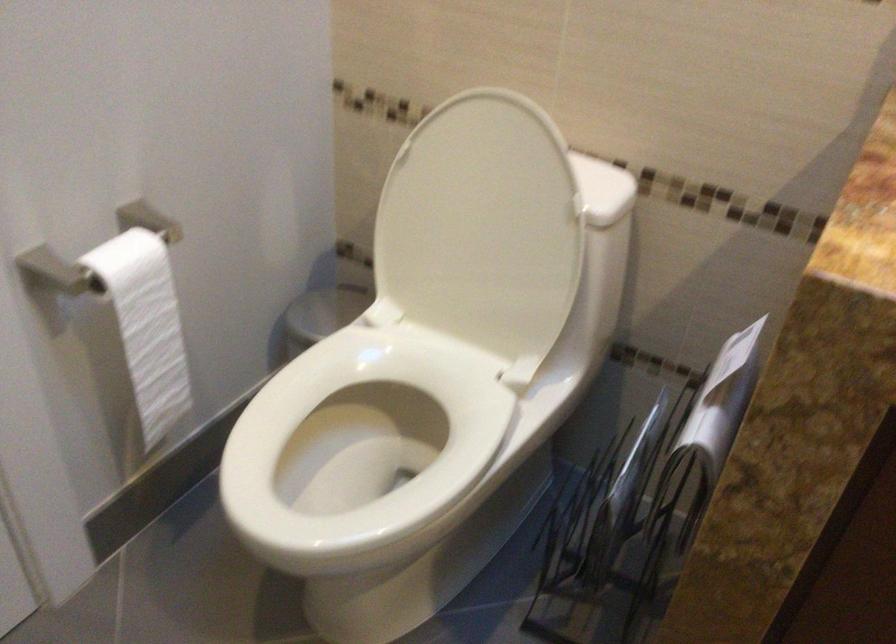
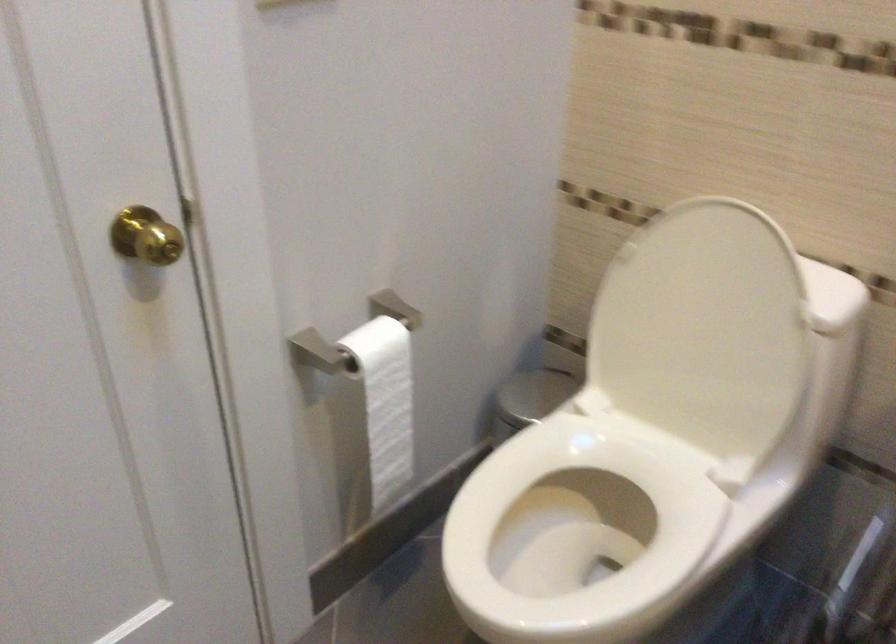
In the second image, find the point that corresponds to [326,313] in the first image.

(532, 395)